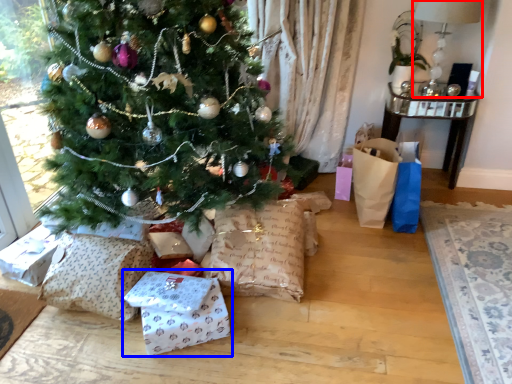
Question: Which object appears closest to the camera in this image, lamp (highlighted by a red box) or gift wrap (highlighted by a blue box)?

Choices:
 (A) lamp
 (B) gift wrap

Answer: (B)